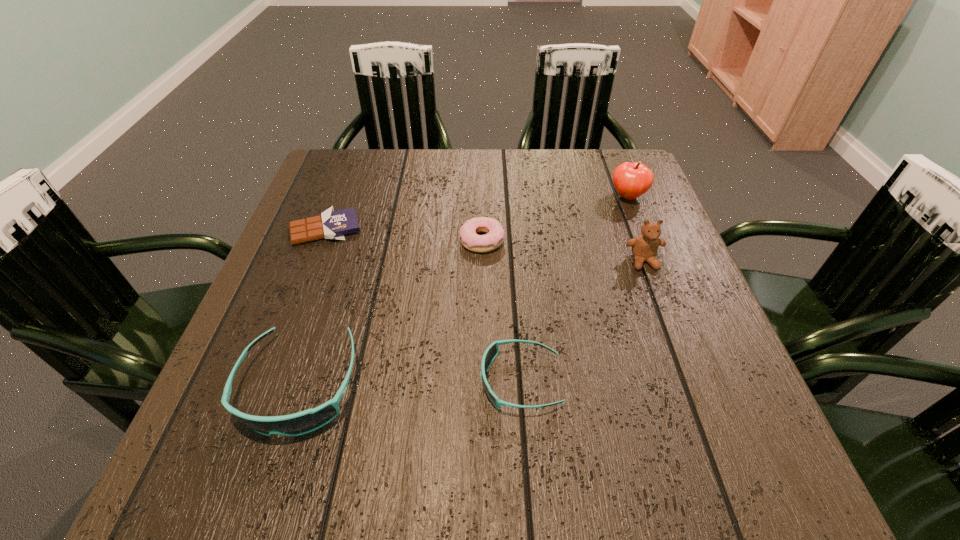
Locate an element on the screen. The width and height of the screenshot is (960, 540). free point that satisfies the following two spatial constraints: 1. on the front side of the fifth tallest object; 2. on the left side of the shortest object is located at coordinates (322, 240).

This screenshot has width=960, height=540. I want to click on vacant space that satisfies the following two spatial constraints: 1. on the face of the teddy bear; 2. on the front-facing side of the right sunglasses, so click(x=687, y=381).